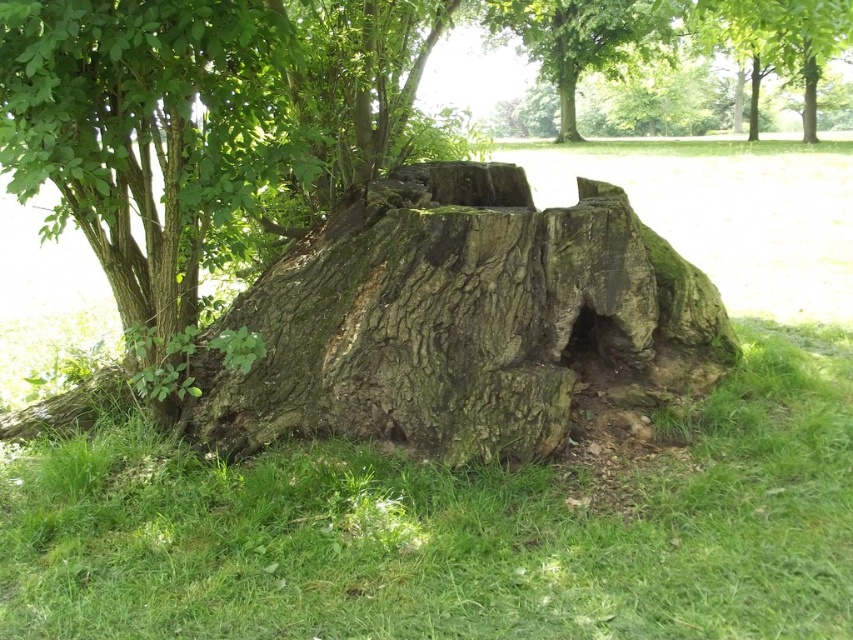
You are standing in a park and see the green grass at lower center and the green mossy stump at center. Which object is nearer to you?

The green grass at lower center is closer to the viewer than the green mossy stump at center.

You are standing in front of the tree stump and looking at the two points marked on the image. Which point, point (374,454) or point (558,92), is closer to you?

Point (374,454) is closer to the viewer than point (558,92).

You are a gardener trying to determine which area is wider between the green grass at lower center and the smooth green bark at upper center. Based on the scene, which one is wider?

The smooth green bark at upper center is wider than the green grass at lower center.